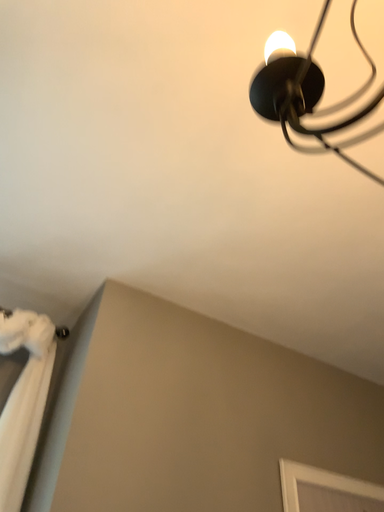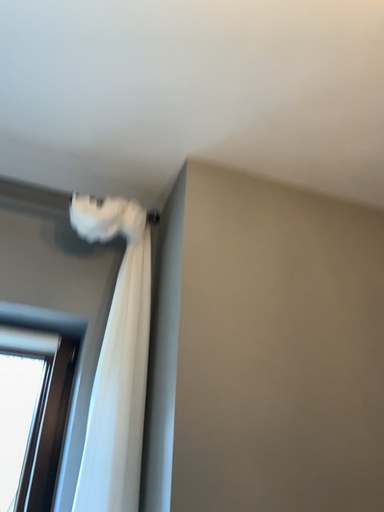
Question: How did the camera likely rotate when shooting the video?

Choices:
 (A) rotated left
 (B) rotated right

Answer: (A)